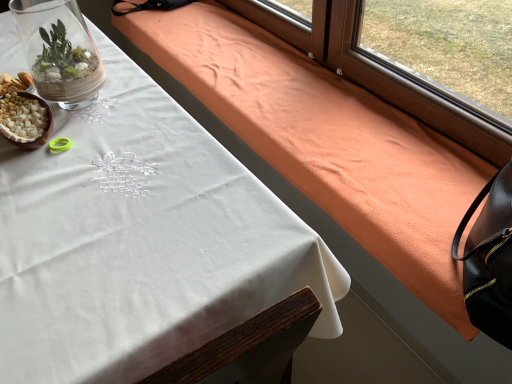
Locate an element on the screen. Image resolution: width=512 pixels, height=384 pixels. vacant region in front of clear glass terrarium at upper left is located at coordinates (78, 150).